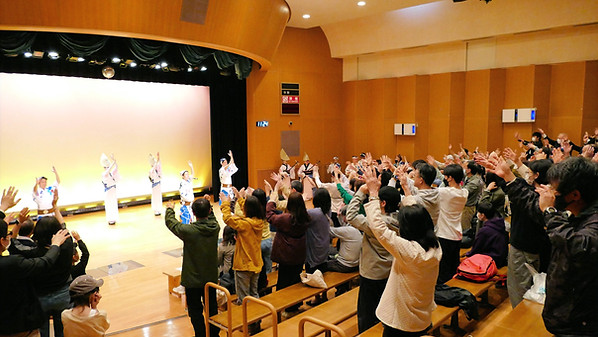
Find the location of a particular element. This screenshot has height=337, width=598. screen is located at coordinates (83, 142).